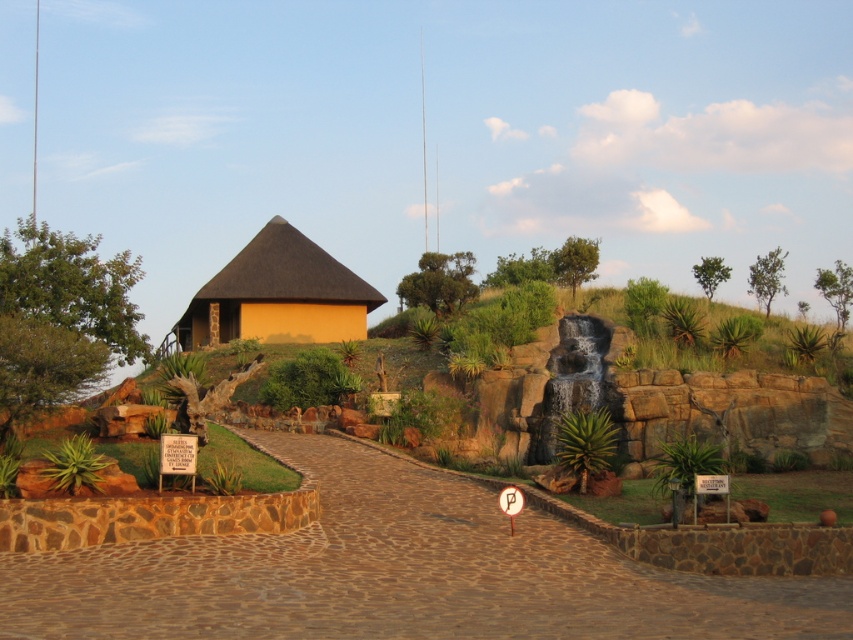
Who is more distant from viewer, [602,616] or [346,298]?

Positioned behind is point [346,298].

Locate an element on the screen. Image resolution: width=853 pixels, height=640 pixels. brown cobblestone path at center is located at coordinates (397, 573).